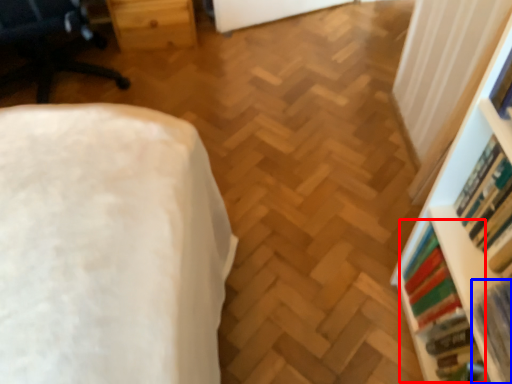
Question: Which of the following is the farthest to the observer, book (highlighted by a red box) or book (highlighted by a blue box)?

Choices:
 (A) book
 (B) book

Answer: (A)